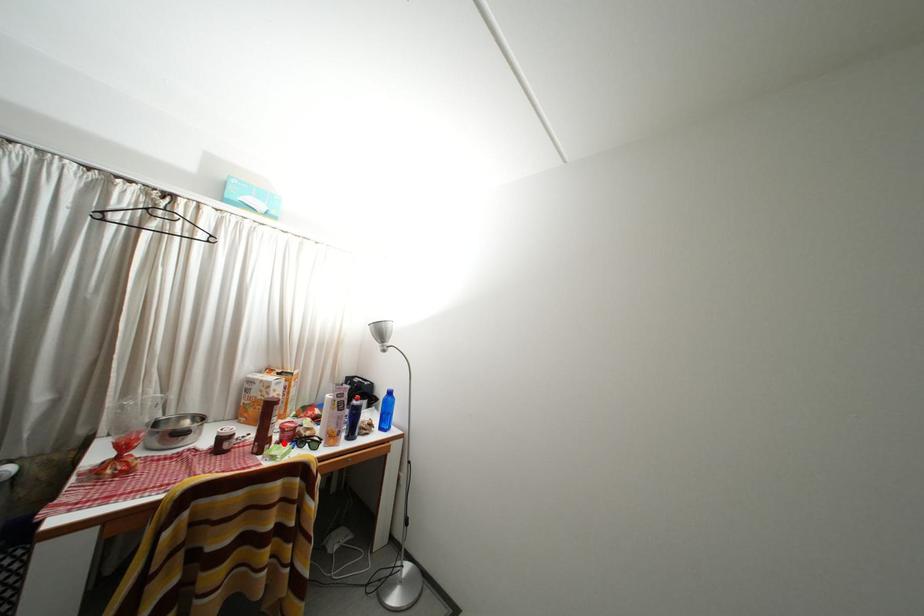
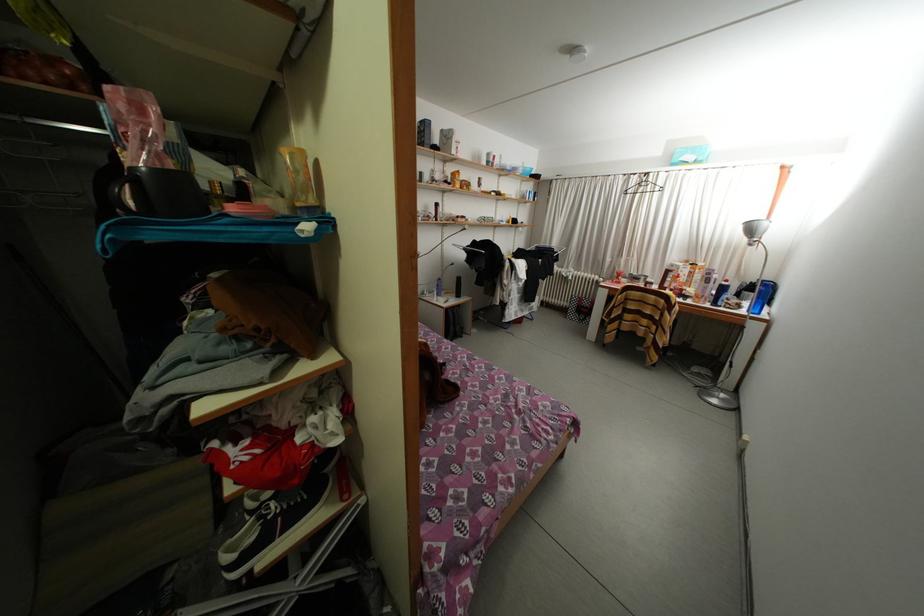
Question: I am providing you with two images of the same scene from different viewpoints. A red point is marked on the first image. Is the red point's position out of view in image 2?

Choices:
 (A) Yes
 (B) No

Answer: (A)